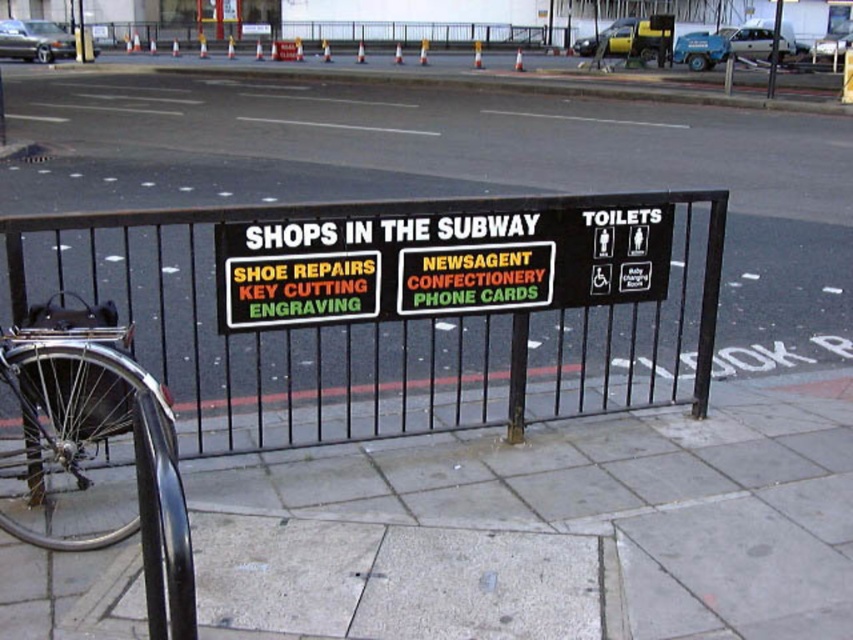
Is gray concrete pavement at lower center wider than polished chrome bicycle at lower left?

Correct, the width of gray concrete pavement at lower center exceeds that of polished chrome bicycle at lower left.

Is gray concrete pavement at lower center positioned behind polished chrome bicycle at lower left?

Yes, gray concrete pavement at lower center is behind polished chrome bicycle at lower left.

Does point (292, 497) come closer to viewer compared to point (36, 545)?

No, it is behind (36, 545).

Image resolution: width=853 pixels, height=640 pixels. Identify the location of gray concrete pavement at lower center. (560, 518).

Between point (654, 220) and point (19, 458), which one is positioned in front?

Positioned in front is point (19, 458).

Can you confirm if black metal fence at center is shorter than polished chrome bicycle at lower left?

Indeed, black metal fence at center has a lesser height compared to polished chrome bicycle at lower left.

The image size is (853, 640). What do you see at coordinates (398, 310) in the screenshot?
I see `black metal fence at center` at bounding box center [398, 310].

This screenshot has width=853, height=640. Identify the location of black metal fence at center. (398, 310).

Measure the distance between point (372, 413) and camera.

4.66 meters

In the scene shown: Who is taller, black metal fence at center or black plastic sign at center?

With more height is black plastic sign at center.

You are a GUI agent. You are given a task and a screenshot of the screen. Output one action in this format:
    pyautogui.click(x=<x>, y=<y>)
    Task: Click on the black metal fence at center
    
    Given the screenshot: What is the action you would take?
    [398, 310]